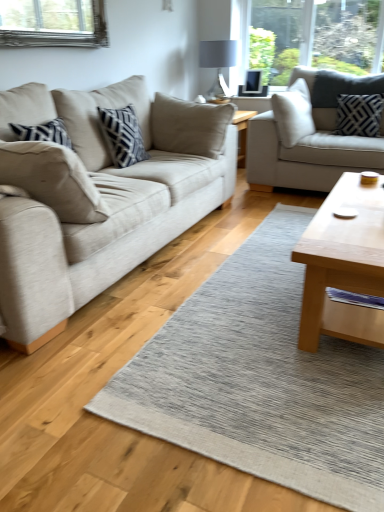
Question: Could you tell me if light brown wooden coffee table at center right is facing beige fabric couch at left, the first studio couch positioned from the left?

Choices:
 (A) yes
 (B) no

Answer: (B)

Question: Is light brown wooden coffee table at center right smaller than beige fabric couch at left, the first studio couch positioned from the left?

Choices:
 (A) no
 (B) yes

Answer: (B)

Question: Is the position of light brown wooden coffee table at center right less distant than that of beige fabric couch at left, the 2th studio couch positioned from the right?

Choices:
 (A) no
 (B) yes

Answer: (A)

Question: Is light brown wooden coffee table at center right positioned with its back to beige fabric couch at left, the first studio couch positioned from the left?

Choices:
 (A) yes
 (B) no

Answer: (A)

Question: Is light brown wooden coffee table at center right next to beige fabric couch at left, the 2th studio couch positioned from the right?

Choices:
 (A) yes
 (B) no

Answer: (B)

Question: Would you say beige fabric couch at left, the 2th studio couch positioned from the right, is to the left or to the right of textured gray rug at center in the picture?

Choices:
 (A) left
 (B) right

Answer: (A)

Question: Considering the positions of beige fabric couch at left, the 2th studio couch positioned from the right, and textured gray rug at center in the image, is beige fabric couch at left, the 2th studio couch positioned from the right, taller or shorter than textured gray rug at center?

Choices:
 (A) tall
 (B) short

Answer: (A)

Question: From the image's perspective, is beige fabric couch at left, the first studio couch positioned from the left, above or below textured gray rug at center?

Choices:
 (A) above
 (B) below

Answer: (A)

Question: Which is correct: beige fabric couch at left, the first studio couch positioned from the left, is inside textured gray rug at center, or outside of it?

Choices:
 (A) inside
 (B) outside

Answer: (B)

Question: Considering their positions, is light gray fabric couch at upper right, placed as the second studio couch when sorted from left to right, located in front of or behind beige fabric pillow at left, which ranks as the second pillow in right-to-left order?

Choices:
 (A) front
 (B) behind

Answer: (B)

Question: Looking at their shapes, would you say light gray fabric couch at upper right, placed as the second studio couch when sorted from left to right, is wider or thinner than beige fabric pillow at left, placed as the first pillow when sorted from bottom to top?

Choices:
 (A) wide
 (B) thin

Answer: (A)

Question: Is point (380, 78) positioned closer to the camera than point (51, 152)?

Choices:
 (A) farther
 (B) closer

Answer: (A)

Question: Considering the positions of light gray fabric couch at upper right, marked as the 1th studio couch in a right-to-left arrangement, and beige fabric pillow at left, which is the 2th pillow in back-to-front order, in the image, is light gray fabric couch at upper right, marked as the 1th studio couch in a right-to-left arrangement, bigger or smaller than beige fabric pillow at left, which is the 2th pillow in back-to-front order,?

Choices:
 (A) small
 (B) big

Answer: (B)

Question: From a real-world perspective, is light brown wooden coffee table at center right above or below matte gray glass lampshade at upper center?

Choices:
 (A) above
 (B) below

Answer: (B)

Question: Visually, is light brown wooden coffee table at center right positioned to the left or to the right of matte gray glass lampshade at upper center?

Choices:
 (A) right
 (B) left

Answer: (A)